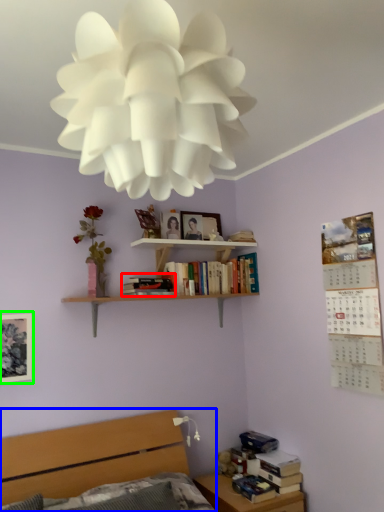
Question: Which is nearer to the book (highlighted by a red box)? bed (highlighted by a blue box) or picture frame (highlighted by a green box).

Choices:
 (A) bed
 (B) picture frame

Answer: (B)